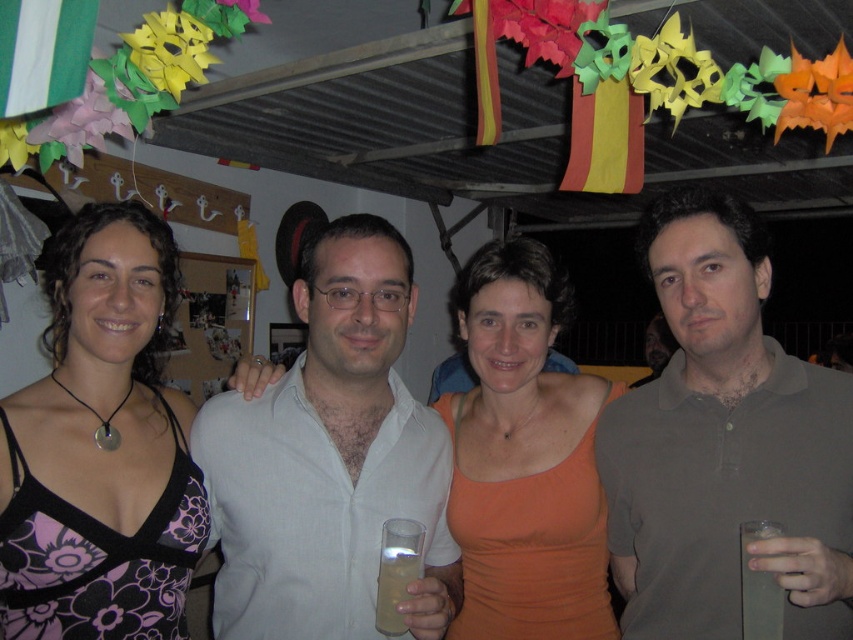
Question: Which object is closer to the camera taking this photo?

Choices:
 (A) clear glass at right
 (B) gray cotton polo shirt at right

Answer: (B)

Question: Which is nearer to the clear glass at right?

Choices:
 (A) gray cotton polo shirt at right
 (B) clear plastic cup at center

Answer: (A)

Question: Does orange fabric tank top at center appear over clear glass at right?

Choices:
 (A) yes
 (B) no

Answer: (A)

Question: Estimate the real-world distances between objects in this image. Which object is farther from the white linen shirt at center?

Choices:
 (A) orange fabric tank top at center
 (B) clear glass at right

Answer: (B)

Question: Does gray cotton polo shirt at right come in front of white linen shirt at center?

Choices:
 (A) no
 (B) yes

Answer: (B)

Question: Does black floral dress at center appear over orange fabric tank top at center?

Choices:
 (A) yes
 (B) no

Answer: (A)